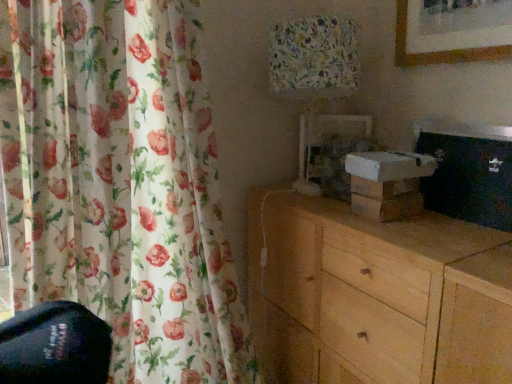
Question: Would you say floral fabric lampshade at upper center contains light wood chest of drawers at lower right?

Choices:
 (A) no
 (B) yes

Answer: (A)

Question: Is floral fabric lampshade at upper center next to light wood chest of drawers at lower right and touching it?

Choices:
 (A) no
 (B) yes

Answer: (A)

Question: Is floral fabric lampshade at upper center closer to the viewer compared to light wood chest of drawers at lower right?

Choices:
 (A) no
 (B) yes

Answer: (A)

Question: Considering the relative sizes of floral fabric lampshade at upper center and light wood chest of drawers at lower right in the image provided, is floral fabric lampshade at upper center thinner than light wood chest of drawers at lower right?

Choices:
 (A) yes
 (B) no

Answer: (A)

Question: Considering the relative sizes of floral fabric lampshade at upper center and light wood chest of drawers at lower right in the image provided, is floral fabric lampshade at upper center smaller than light wood chest of drawers at lower right?

Choices:
 (A) no
 (B) yes

Answer: (B)

Question: Is floral fabric lampshade at upper center shorter than light wood chest of drawers at lower right?

Choices:
 (A) yes
 (B) no

Answer: (A)

Question: Does light wood chest of drawers at lower right contain floral fabric lampshade at upper center?

Choices:
 (A) no
 (B) yes

Answer: (A)

Question: Are light wood chest of drawers at lower right and floral fabric lampshade at upper center far apart?

Choices:
 (A) yes
 (B) no

Answer: (B)

Question: Considering the relative sizes of light wood chest of drawers at lower right and floral fabric lampshade at upper center in the image provided, is light wood chest of drawers at lower right wider than floral fabric lampshade at upper center?

Choices:
 (A) no
 (B) yes

Answer: (B)

Question: Does light wood chest of drawers at lower right appear on the left side of floral fabric lampshade at upper center?

Choices:
 (A) no
 (B) yes

Answer: (A)

Question: Is light wood chest of drawers at lower right next to floral fabric lampshade at upper center?

Choices:
 (A) no
 (B) yes

Answer: (A)

Question: Does light wood chest of drawers at lower right have a smaller size compared to floral fabric lampshade at upper center?

Choices:
 (A) no
 (B) yes

Answer: (A)

Question: Can you confirm if floral fabric lampshade at upper center is thinner than floral fabric curtain at left?

Choices:
 (A) yes
 (B) no

Answer: (A)